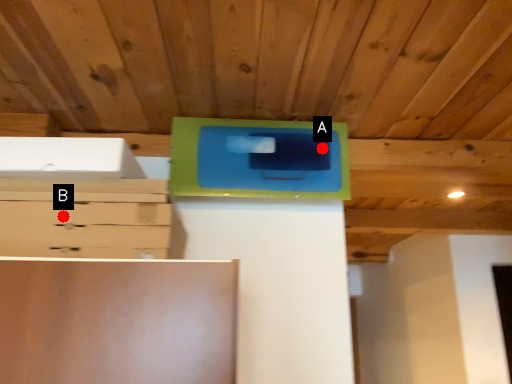
Question: Two points are circled on the image, labeled by A and B beside each circle. Which point is closer to the camera taking this photo?

Choices:
 (A) A is closer
 (B) B is closer

Answer: (B)